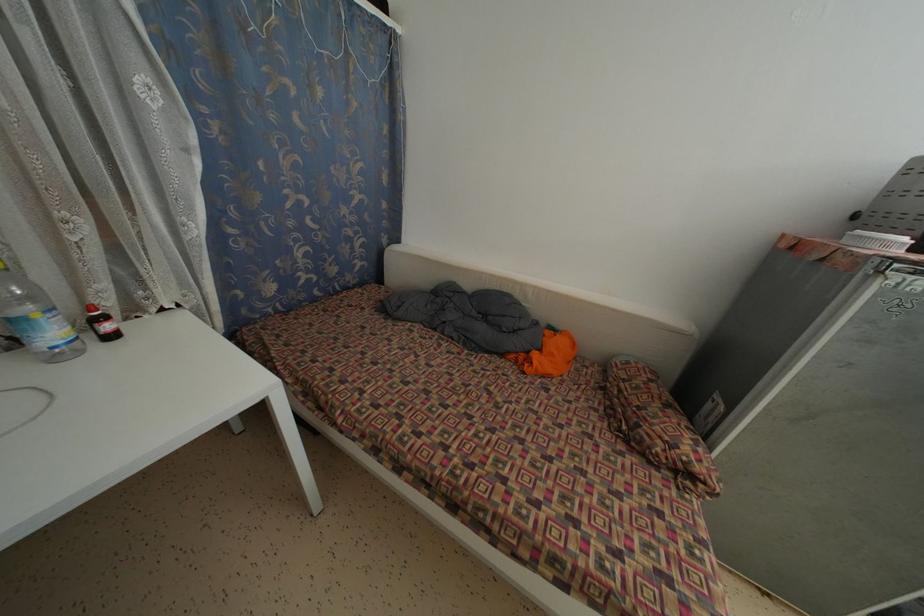
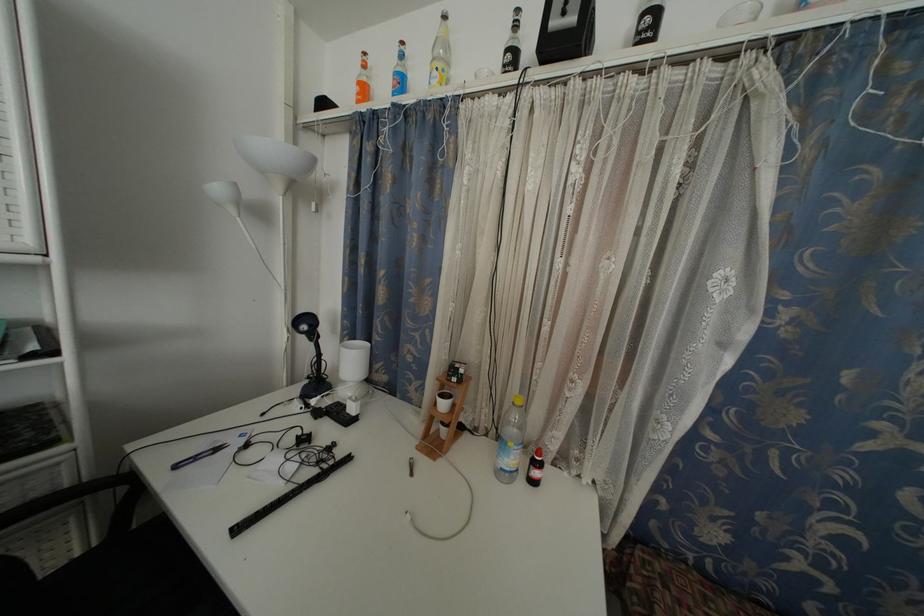
Question: The camera is either moving clockwise (left) or counter-clockwise (right) around the object. The first image is from the beginning of the video and the second image is from the end. Is the camera moving left or right when shooting the video?

Choices:
 (A) Left
 (B) Right

Answer: (B)